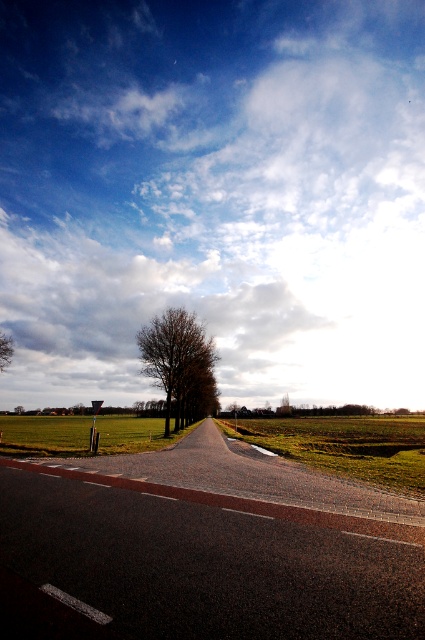
Question: Which of the following is the farthest from the observer?

Choices:
 (A) (156, 342)
 (B) (28, 278)
 (C) (101, 420)

Answer: (B)

Question: Can you confirm if green grassy field at center is bigger than bare branches at center?

Choices:
 (A) no
 (B) yes

Answer: (B)

Question: Based on their relative distances, which object is nearer to the bare branches at center?

Choices:
 (A) cloudy sky at upper center
 (B) green grassy field at center
 (C) bare branches at left
 (D) green grass field at lower left

Answer: (D)

Question: Is cloudy sky at upper center smaller than bare branches at center?

Choices:
 (A) yes
 (B) no

Answer: (B)

Question: Which point appears closest to the camera in this image?

Choices:
 (A) (170, 374)
 (B) (269, 442)
 (C) (147, 440)
 (D) (67, 253)

Answer: (B)

Question: Considering the relative positions of bare branches at center and green grass field at lower left in the image provided, where is bare branches at center located with respect to green grass field at lower left?

Choices:
 (A) above
 (B) below

Answer: (A)